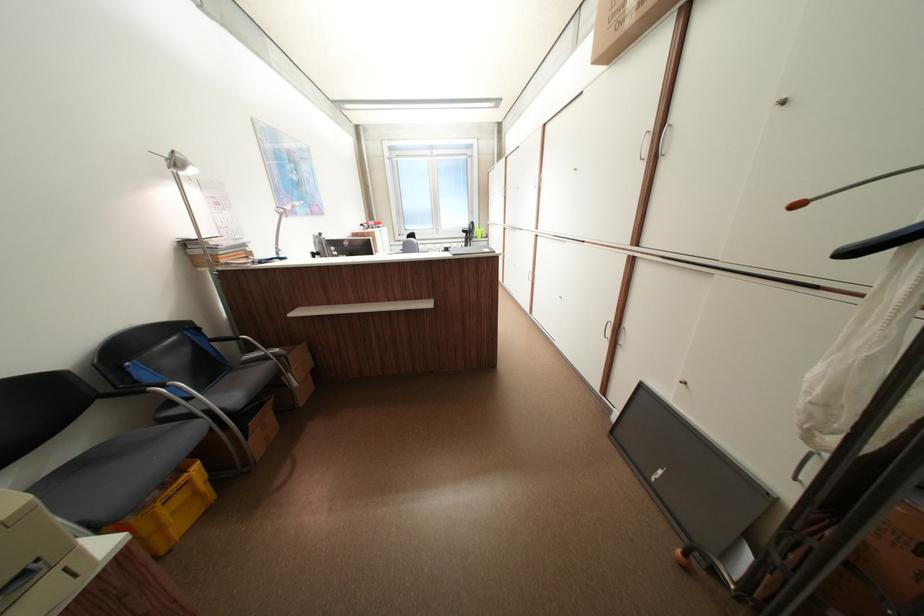
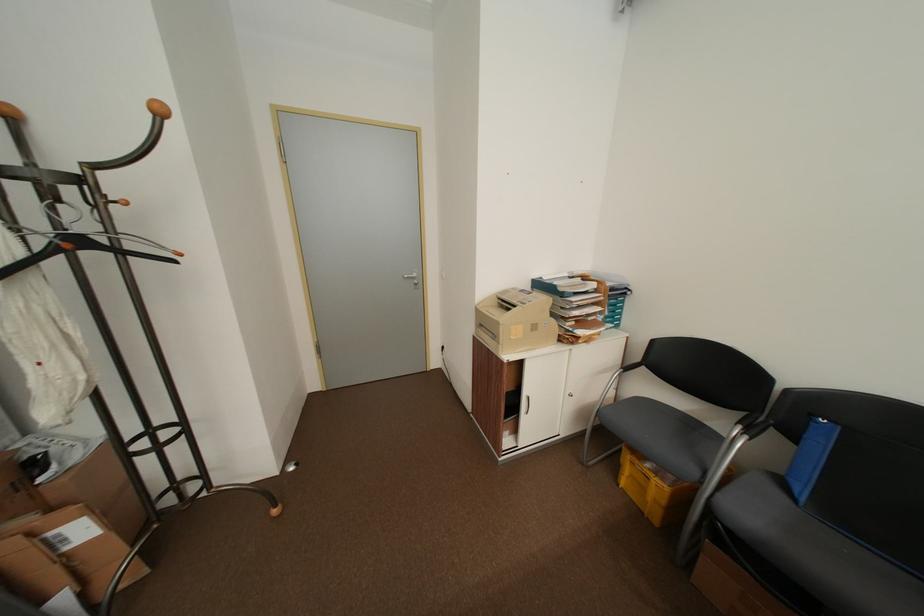
Where in the second image is the point corresponding to the point at 209,464 from the first image?

(676, 488)